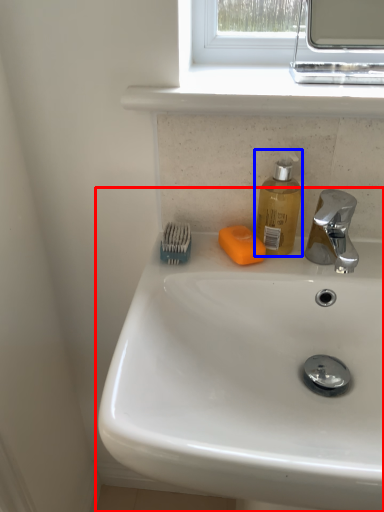
Question: Which object is closer to the camera taking this photo, sink (highlighted by a red box) or soap dispenser (highlighted by a blue box)?

Choices:
 (A) sink
 (B) soap dispenser

Answer: (A)